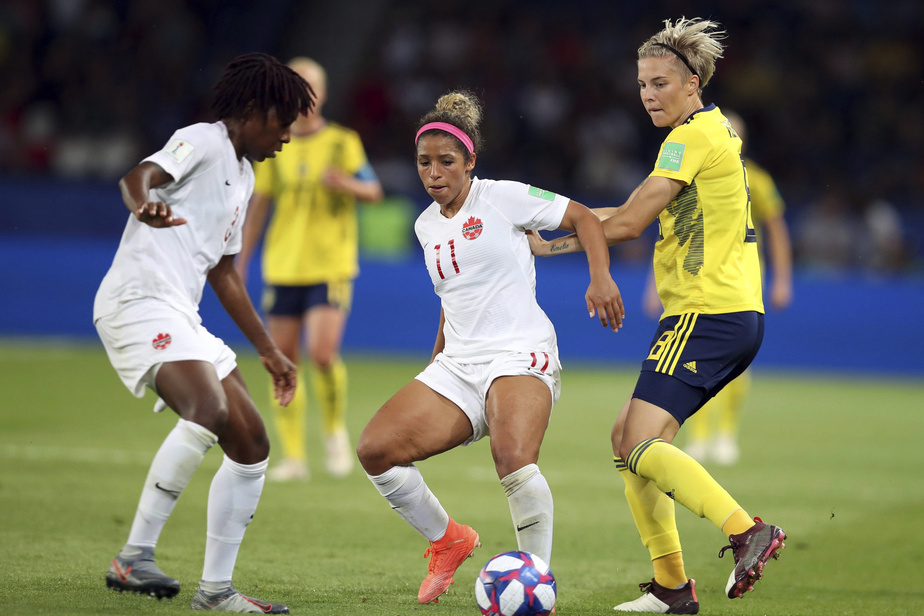
Find the location of a particular element. This screenshot has width=924, height=616. sock is located at coordinates (687, 485), (652, 515), (523, 505), (423, 514), (339, 394), (286, 408), (224, 528), (172, 484), (727, 403), (699, 418).